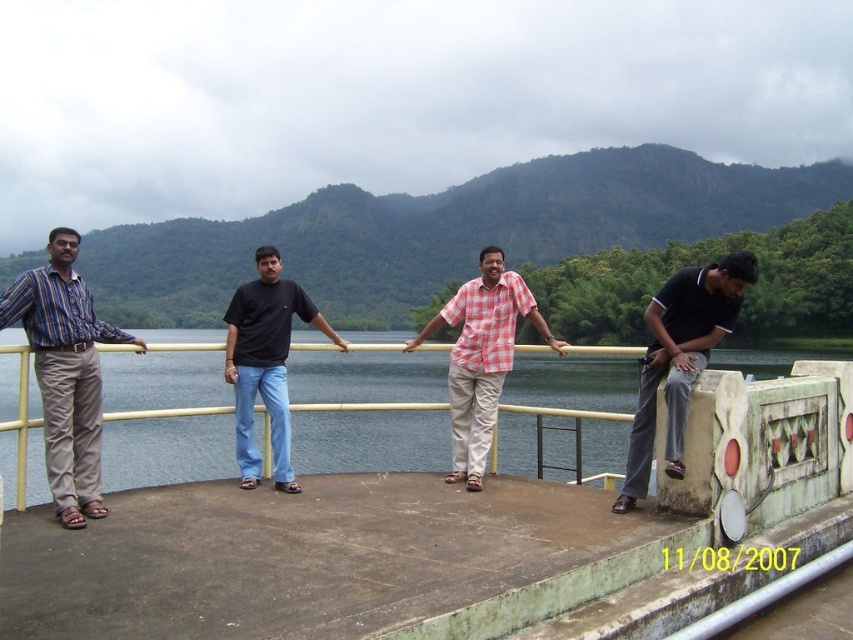
What do you see at coordinates (368, 410) in the screenshot? The height and width of the screenshot is (640, 853). I see `clear water at center` at bounding box center [368, 410].

Measure the distance from clear water at center to black cotton shirt at center.

clear water at center is 42.09 meters from black cotton shirt at center.

Does point (737, 358) lie behind point (271, 276)?

Yes.

Where is `clear water at center`? clear water at center is located at coordinates (368, 410).

Where is `clear water at center`? This screenshot has width=853, height=640. clear water at center is located at coordinates (368, 410).

Where is `clear water at center`? clear water at center is located at coordinates (368, 410).

This screenshot has width=853, height=640. Identify the location of clear water at center. (368, 410).

Can you confirm if clear water at center is thinner than checkered fabric shirt at center?

Incorrect, clear water at center's width is not less than checkered fabric shirt at center's.

Is clear water at center in front of checkered fabric shirt at center?

Yes, clear water at center is closer to the viewer.

At what (x,y) coordinates should I click in order to perform the action: click on clear water at center. Please return your answer as a coordinate pair (x, y). Looking at the image, I should click on (368, 410).

The image size is (853, 640). I want to click on clear water at center, so click(x=368, y=410).